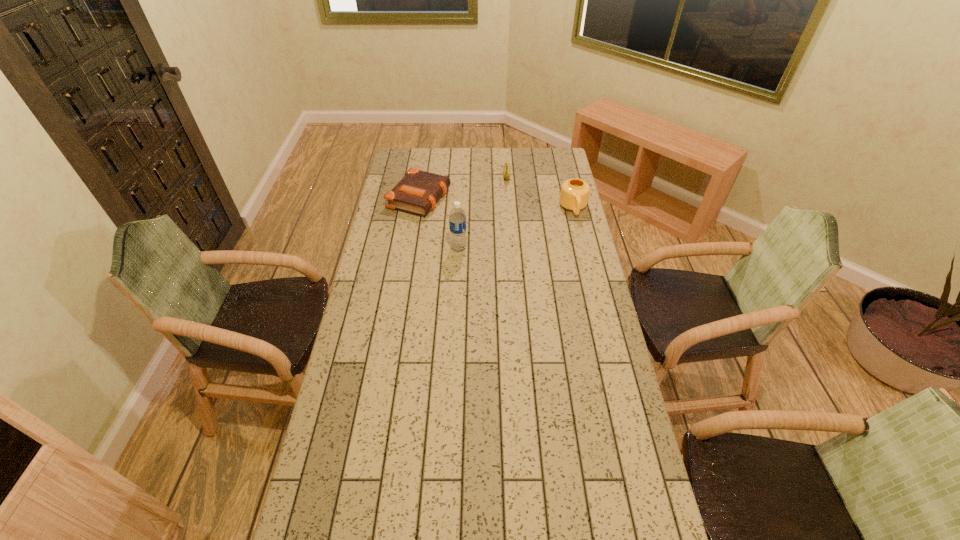
Locate an element on the screen. Image resolution: width=960 pixels, height=540 pixels. vacant space at the near edge is located at coordinates (451, 500).

The image size is (960, 540). In the image, there is a desktop. Find the location of `free region at the left edge`. free region at the left edge is located at coordinates (354, 316).

Where is `vacant area at the right edge of the desktop`? This screenshot has height=540, width=960. vacant area at the right edge of the desktop is located at coordinates (570, 262).

In order to click on vacant space at the far left corner of the desktop in this screenshot , I will do `click(405, 147)`.

The height and width of the screenshot is (540, 960). In order to click on vacant point at the far right corner in this screenshot , I will do `click(567, 170)`.

This screenshot has width=960, height=540. In order to click on vacant space at the near right corner of the desktop in this screenshot , I will do `click(611, 523)`.

You are a GUI agent. You are given a task and a screenshot of the screen. Output one action in this format:
    pyautogui.click(x=<x>, y=<y>)
    Task: Click on the free space between the second shortest object and the second object from left to right
    Image resolution: width=960 pixels, height=540 pixels.
    Given the screenshot: What is the action you would take?
    pyautogui.click(x=483, y=211)

Find the location of a particular element. free area in between the rightmost object and the Bible is located at coordinates (496, 204).

Find the location of `vacant point located between the second shortest object and the water bottle`. vacant point located between the second shortest object and the water bottle is located at coordinates (483, 211).

In order to click on free space between the second tallest object and the shortest object in this screenshot , I will do `click(496, 204)`.